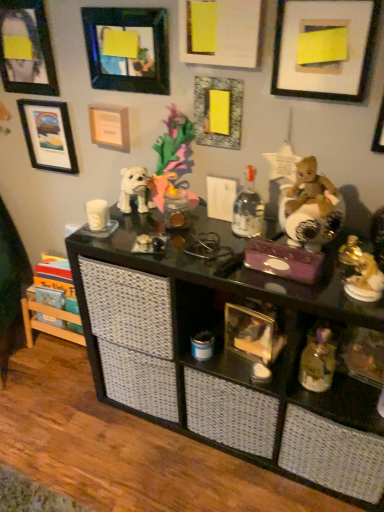
Question: Can matte yellow paper at center, the 3th picture frame positioned from the right, be found inside matte black picture frame at upper left, the first picture frame viewed from the left?

Choices:
 (A) yes
 (B) no

Answer: (B)

Question: Is matte black picture frame at upper left, the first picture frame viewed from the left, directly adjacent to matte yellow paper at center, the sixth picture frame positioned from the left?

Choices:
 (A) yes
 (B) no

Answer: (B)

Question: Can you confirm if matte black picture frame at upper left, the eighth picture frame from the right, is smaller than matte yellow paper at center, the 3th picture frame positioned from the right?

Choices:
 (A) yes
 (B) no

Answer: (B)

Question: Does matte black picture frame at upper left, the eighth picture frame from the right, appear on the left side of matte yellow paper at center, the sixth picture frame positioned from the left?

Choices:
 (A) no
 (B) yes

Answer: (B)

Question: From the image's perspective, is matte black picture frame at upper left, the eighth picture frame from the right, under matte yellow paper at center, the sixth picture frame positioned from the left?

Choices:
 (A) no
 (B) yes

Answer: (A)

Question: From the image's perspective, relative to matte white frame at upper right, placed as the seventh picture frame when sorted from left to right, is black glass shelf at center above or below?

Choices:
 (A) below
 (B) above

Answer: (A)

Question: Is black glass shelf at center bigger or smaller than matte white frame at upper right, placed as the seventh picture frame when sorted from left to right?

Choices:
 (A) small
 (B) big

Answer: (B)

Question: From a real-world perspective, is black glass shelf at center physically located above or below matte white frame at upper right, placed as the seventh picture frame when sorted from left to right?

Choices:
 (A) above
 (B) below

Answer: (B)

Question: Considering the positions of black glass shelf at center and matte white frame at upper right, which is counted as the 2th picture frame, starting from the right, in the image, is black glass shelf at center wider or thinner than matte white frame at upper right, which is counted as the 2th picture frame, starting from the right,?

Choices:
 (A) thin
 (B) wide

Answer: (B)

Question: From a real-world perspective, is clear glass bottle at center positioned above or below black glass shelf at center?

Choices:
 (A) below
 (B) above

Answer: (B)

Question: Is point (246, 226) positioned closer to the camera than point (200, 303)?

Choices:
 (A) farther
 (B) closer

Answer: (B)

Question: Considering the relative positions of clear glass bottle at center and black glass shelf at center in the image provided, is clear glass bottle at center to the left or to the right of black glass shelf at center?

Choices:
 (A) right
 (B) left

Answer: (B)

Question: Is clear glass bottle at center bigger or smaller than black glass shelf at center?

Choices:
 (A) big
 (B) small

Answer: (B)

Question: Looking at their shapes, would you say matte white frame at upper right, which is counted as the 2th picture frame, starting from the right, is wider or thinner than clear glass bottle at center?

Choices:
 (A) thin
 (B) wide

Answer: (A)

Question: Is matte white frame at upper right, placed as the seventh picture frame when sorted from left to right, taller or shorter than clear glass bottle at center?

Choices:
 (A) short
 (B) tall

Answer: (B)